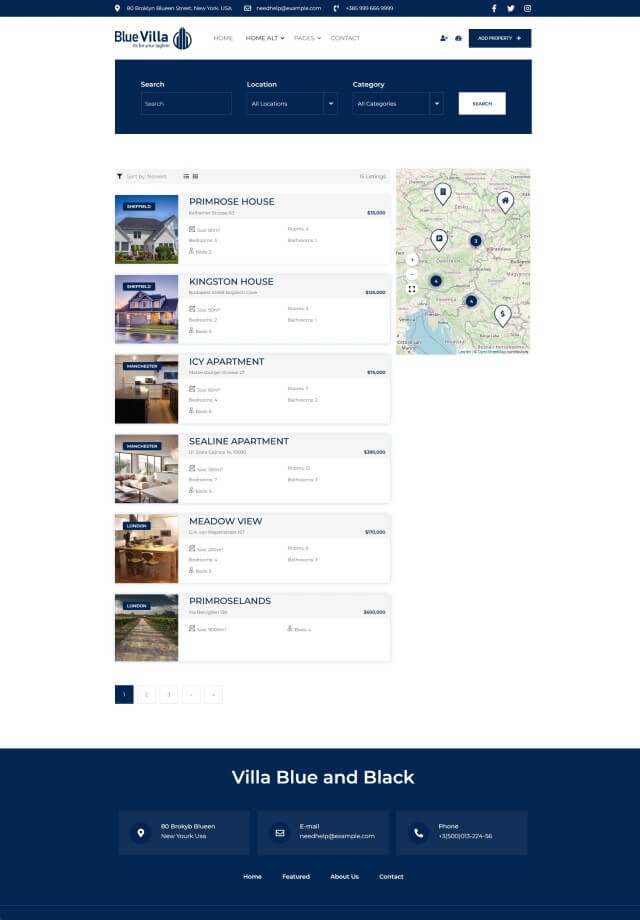
Locate an element on the screen. thumbnail image of "sealine apartment" living room is located at coordinates (134, 468).